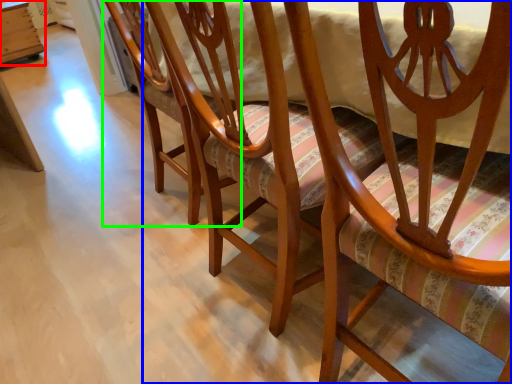
Question: Considering the real-world distances, which object is closest to table (highlighted by a red box)? chair (highlighted by a blue box) or chair (highlighted by a green box).

Choices:
 (A) chair
 (B) chair

Answer: (B)